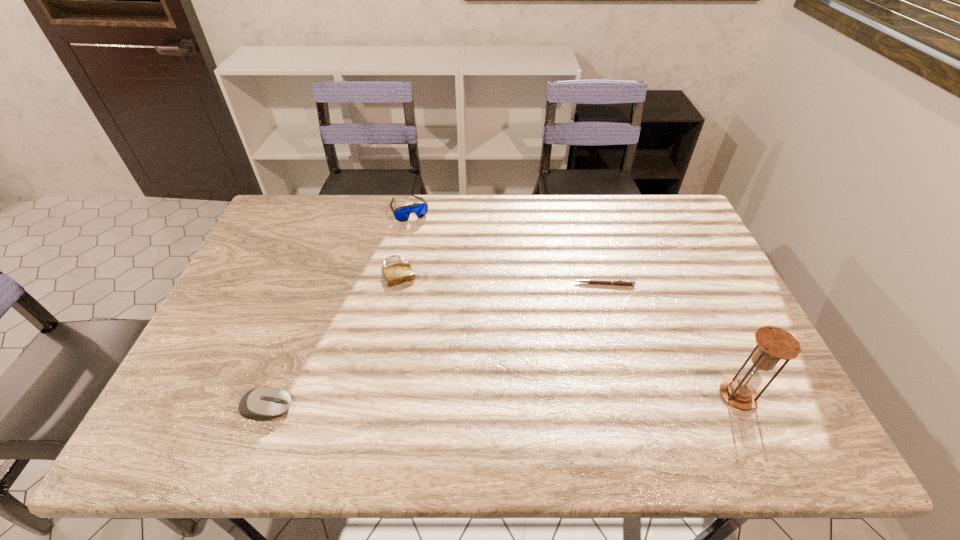
Locate an element on the screen. free spot on the desktop that is between the leftmost object and the hourglass and is positioned on the keyhole side of the fourth tallest object is located at coordinates [461, 402].

Where is `vacant space on the desktop that is between the leftmost object and the tallest object and is positioned on the front-facing side of the farthest object`? This screenshot has width=960, height=540. vacant space on the desktop that is between the leftmost object and the tallest object and is positioned on the front-facing side of the farthest object is located at coordinates (507, 401).

The width and height of the screenshot is (960, 540). What are the coordinates of `free space on the desktop that is between the computer equipment and the tallest object and is positioned at the nib of the shortest object` in the screenshot? It's located at (518, 401).